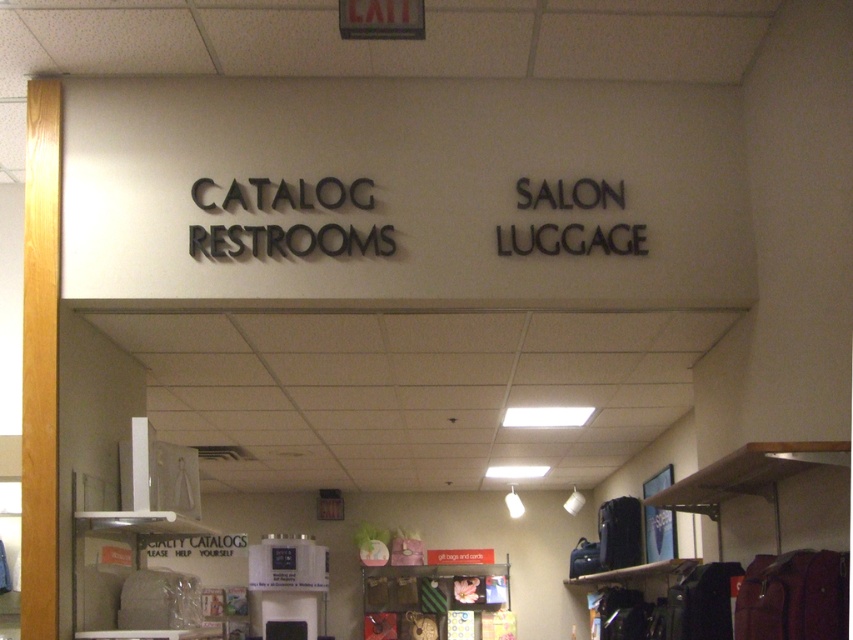
You are a customer entering the store and want to locate the restroom. You see the black matte sign at center and the black metallic sign at upper right. Which sign should you look at to find the restroom location?

The black matte sign at center has a larger size compared to the black metallic sign at upper right, so it is more likely to indicate the restroom location.

You are standing in the retail store and see two points marked in the scene. The first point is at coordinate (361, 177) and the second point is at (514, 252). Which point is closer to you?

Point (361, 177) is further to the camera than point (514, 252), so the second point is closer to you.

You are a customer looking for the restroom. You see the black matte sign at center and the matte black wallet at center. Which object is closer to you?

The black matte sign at center is closer to the viewer than the matte black wallet at center.